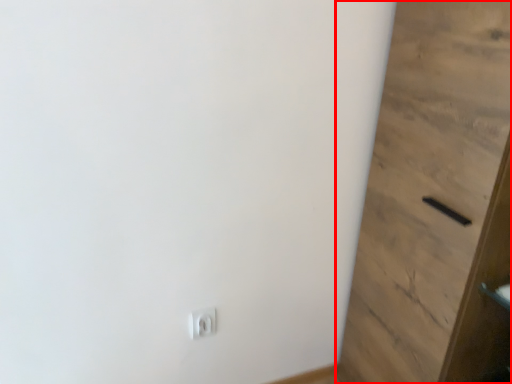
Question: Considering the relative positions of door (annotated by the red box) and light switch in the image provided, where is door (annotated by the red box) located with respect to the staircase?

Choices:
 (A) left
 (B) right

Answer: (B)